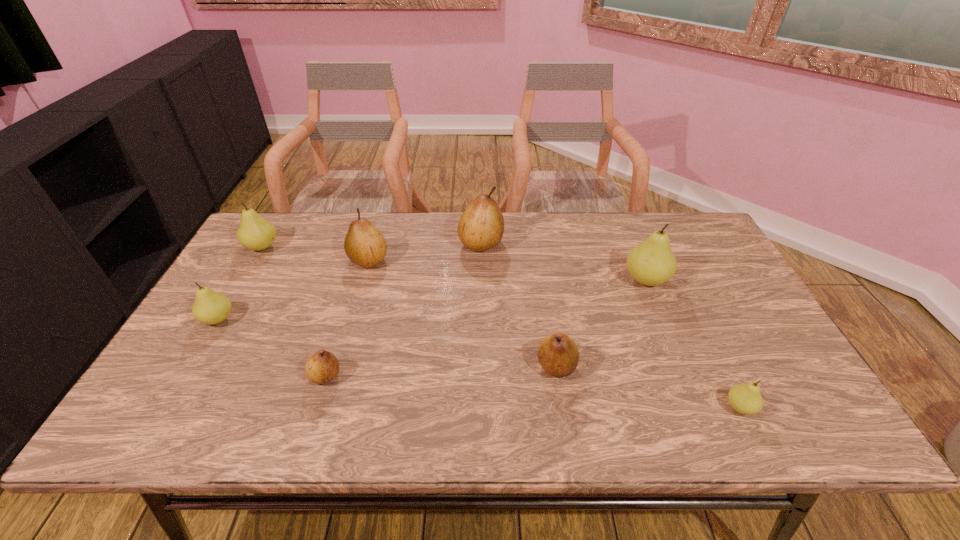
The image size is (960, 540). Find the location of `free space between the third smallest brown pear and the second brown pear from right to left`. free space between the third smallest brown pear and the second brown pear from right to left is located at coordinates (424, 252).

Identify the location of blank region between the third biggest green pear and the fourth pear from right to left. (349, 281).

Identify the location of free point between the third object from right to left and the biggest brown pear. This screenshot has width=960, height=540. (518, 305).

The height and width of the screenshot is (540, 960). I want to click on vacant point located between the smallest green pear and the biggest green pear, so click(693, 343).

Find the location of a particular element. Image resolution: width=960 pixels, height=540 pixels. vacant space in between the second biggest brown pear and the sixth object from left to right is located at coordinates (463, 313).

Where is `free point between the smallest brown pear and the biggest green pear`? free point between the smallest brown pear and the biggest green pear is located at coordinates (486, 328).

Where is `free space between the nearest pear and the second biggest green pear`? The image size is (960, 540). free space between the nearest pear and the second biggest green pear is located at coordinates (501, 327).

Locate an element on the screen. The width and height of the screenshot is (960, 540). free spot between the nearest object and the smallest brown pear is located at coordinates (533, 392).

Locate an element on the screen. empty space between the biggest brown pear and the smallest brown pear is located at coordinates (403, 310).

Image resolution: width=960 pixels, height=540 pixels. I want to click on empty space that is in between the fourth object from right to left and the third object from right to left, so click(518, 305).